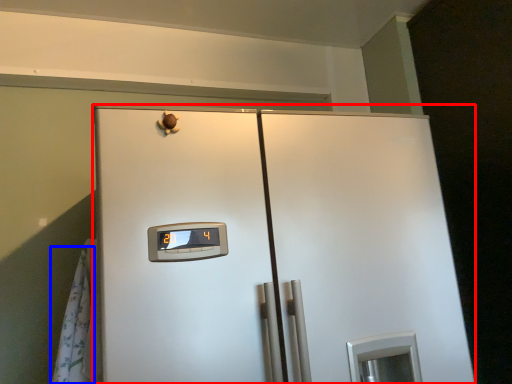
Question: Which object is further to the camera taking this photo, refrigerator (highlighted by a red box) or curtain (highlighted by a blue box)?

Choices:
 (A) refrigerator
 (B) curtain

Answer: (B)